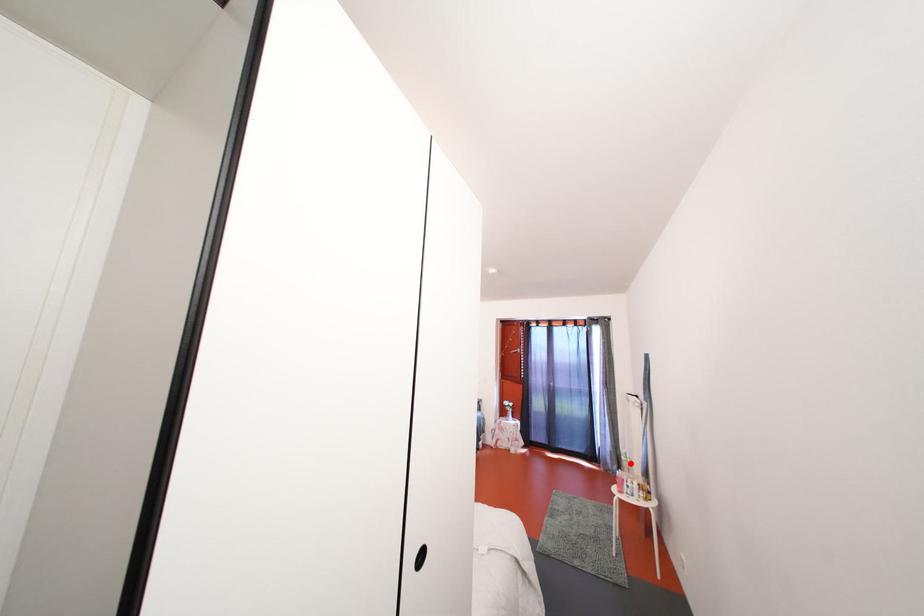
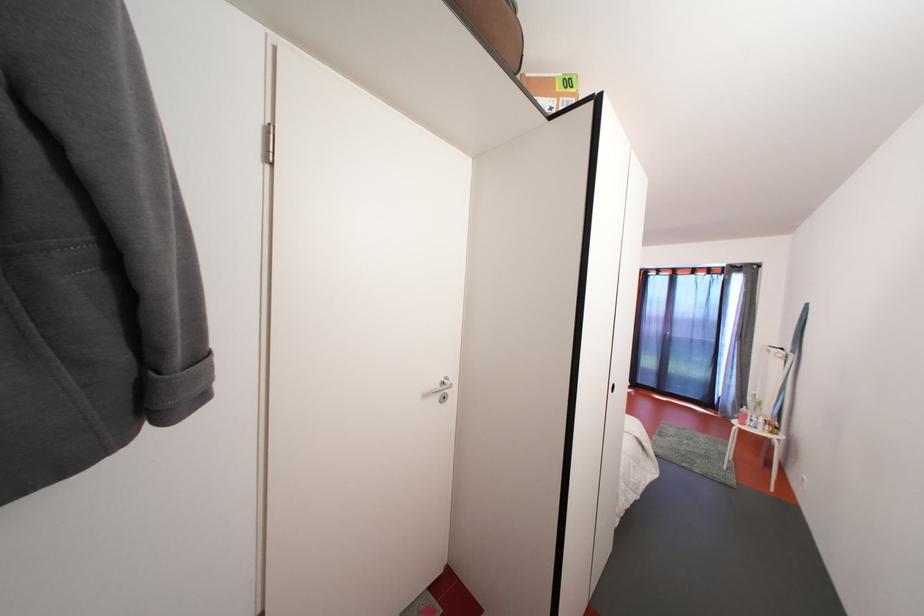
Question: I am providing you with two images of the same scene from different viewpoints. In image1, a red point is highlighted. Considering the same 3D point in image2, which of the following is correct?

Choices:
 (A) It is closer
 (B) It is farther

Answer: (B)